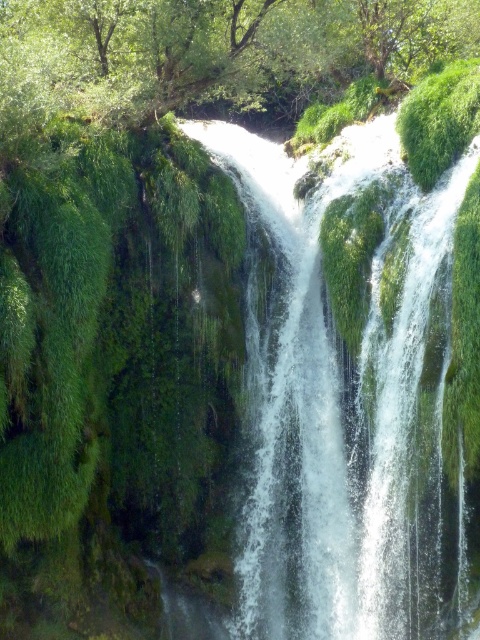
Which is more to the right, white frothy water at center or green mossy tree at upper center?

white frothy water at center is more to the right.

Is point (305, 554) closer to camera compared to point (348, 36)?

Yes, point (305, 554) is in front of point (348, 36).

This screenshot has height=640, width=480. In order to click on white frothy water at center in this screenshot , I will do `click(339, 410)`.